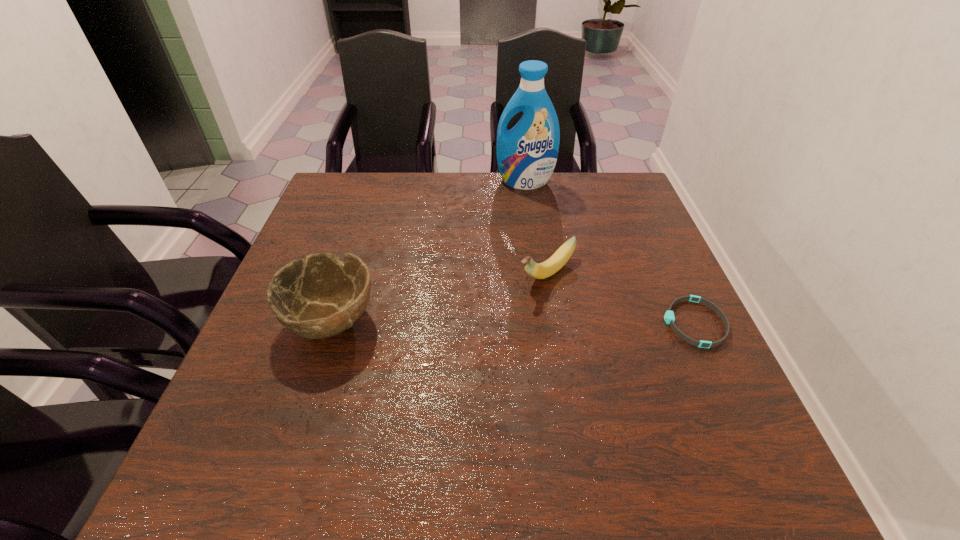
You are a GUI agent. You are given a task and a screenshot of the screen. Output one action in this format:
    pyautogui.click(x=<x>, y=<y>)
    Task: Click on the free space at the near edge of the desktop
    The height and width of the screenshot is (540, 960).
    Given the screenshot: What is the action you would take?
    pyautogui.click(x=611, y=396)

This screenshot has width=960, height=540. Identify the location of free space at the left edge. (314, 379).

Locate an element on the screen. The width and height of the screenshot is (960, 540). vacant space at the right edge is located at coordinates (698, 355).

Image resolution: width=960 pixels, height=540 pixels. What are the coordinates of `vacant space at the far left corner of the desktop` in the screenshot? It's located at (313, 213).

This screenshot has height=540, width=960. Identify the location of vacant space at the far right corner of the desktop. (640, 196).

This screenshot has width=960, height=540. I want to click on free space between the banana and the detergent, so click(x=536, y=227).

Where is `free space between the wristband and the banana`? The height and width of the screenshot is (540, 960). free space between the wristband and the banana is located at coordinates (621, 298).

Locate an element on the screen. free point between the banana and the rightmost object is located at coordinates (621, 298).

In order to click on unoccupied position between the farthest object and the banana in this screenshot , I will do `click(536, 227)`.

Locate an element on the screen. The image size is (960, 540). unoccupied area between the shortest object and the bowl is located at coordinates pyautogui.click(x=513, y=321).